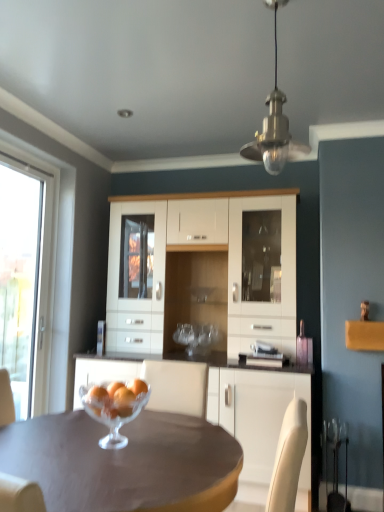
Image resolution: width=384 pixels, height=512 pixels. Find the location of `free space in front of clear glass bowl at center`. free space in front of clear glass bowl at center is located at coordinates (111, 463).